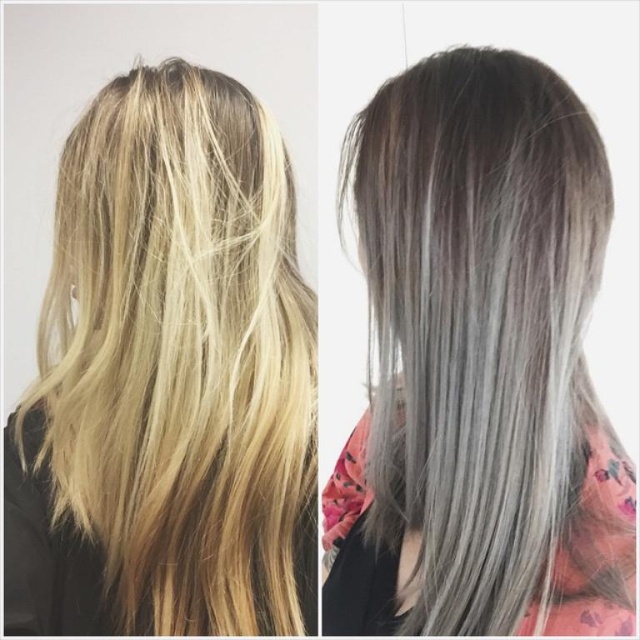
You are a photographer standing in front of the two hair style comparison images. You want to focus your camera on the point at point (166, 298) and then move the focus to point (372, 595). Which direction should you move the camera to shift focus from the first point to the second?

To shift focus from point (166, 298) to point (372, 595), you should move the camera to the right and downward since point (372, 595) is located to the right and lower than point (166, 298).

You are a hairstylist analyzing the image. The client wants to know if their blonde silky hair at center is positioned in the exact center of the image. Can you confirm this based on the coordinates provided?

The blonde silky hair at center is located at point (168, 380), which is close to the center but not exactly at the center coordinates of (320, 320). Therefore, it is slightly off to the right and lower than the exact center.

Please describe the location of the blonde silky hair at center in terms of coordinates within the image. The coordinate system is normalized, with the origin at the bottom left corner of the image. The x and y axes are measured in fractions of the image width and height respectively. For example, the center of the image would be at point 0.5, 0.5. Please provide your answer in the format of coordinates like (168, 380).

The blonde silky hair at center is located at coordinates (168, 380).